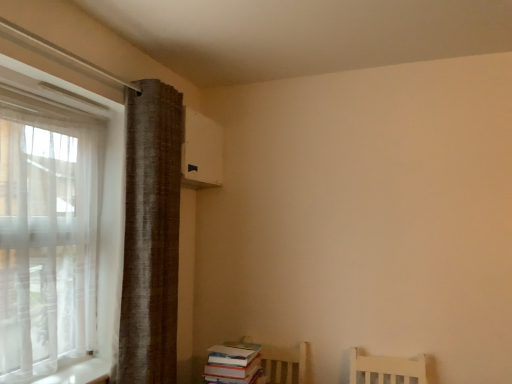
Question: Considering the relative positions of hardcover books at lower right and brown textured curtain at left in the image provided, is hardcover books at lower right to the left or to the right of brown textured curtain at left?

Choices:
 (A) left
 (B) right

Answer: (B)

Question: Considering the positions of point (232, 349) and point (159, 274), is point (232, 349) closer or farther from the camera than point (159, 274)?

Choices:
 (A) closer
 (B) farther

Answer: (B)

Question: Based on their sizes in the image, would you say hardcover books at lower right is bigger or smaller than brown textured curtain at left?

Choices:
 (A) big
 (B) small

Answer: (B)

Question: From the image's perspective, relative to hardcover books at lower right, is brown textured curtain at left above or below?

Choices:
 (A) below
 (B) above

Answer: (B)

Question: Based on their positions, is brown textured curtain at left located to the left or right of hardcover books at lower right?

Choices:
 (A) right
 (B) left

Answer: (B)

Question: Is brown textured curtain at left wider or thinner than hardcover books at lower right?

Choices:
 (A) thin
 (B) wide

Answer: (A)

Question: Is brown textured curtain at left taller or shorter than hardcover books at lower right?

Choices:
 (A) tall
 (B) short

Answer: (A)